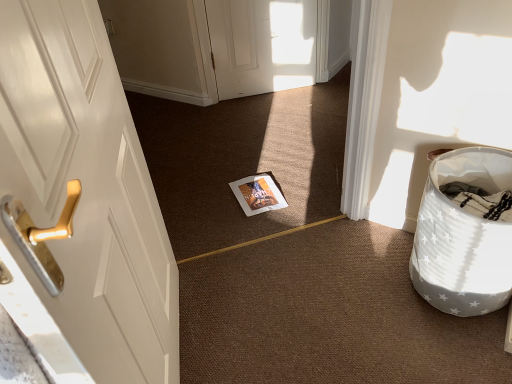
What do you see at coordinates (463, 237) in the screenshot?
I see `white star-patterned laundry basket at right` at bounding box center [463, 237].

I want to click on white star-patterned laundry basket at right, so coord(463,237).

You are a GUI agent. You are given a task and a screenshot of the screen. Output one action in this format:
    pyautogui.click(x=<x>, y=<y>)
    Task: Click on the matte paper magazine at center
    Image resolution: width=512 pixels, height=384 pixels.
    Given the screenshot: What is the action you would take?
    pyautogui.click(x=258, y=194)

What do you see at coordinates (258, 194) in the screenshot? The height and width of the screenshot is (384, 512). I see `matte paper magazine at center` at bounding box center [258, 194].

I want to click on white star-patterned laundry basket at right, so click(463, 237).

Is white star-patterned laundry basket at right at the left side of matte paper magazine at center?

In fact, white star-patterned laundry basket at right is to the right of matte paper magazine at center.

Based on the photo, is white star-patterned laundry basket at right closer to the viewer compared to matte paper magazine at center?

Yes, it is in front of matte paper magazine at center.

Which is more distant, (472, 180) or (260, 173)?

The point (260, 173) is behind.

In the scene shown: From the image's perspective, which is above, white star-patterned laundry basket at right or matte paper magazine at center?

matte paper magazine at center is shown above in the image.

From a real-world perspective, is white star-patterned laundry basket at right above or below matte paper magazine at center?

Clearly, from a real-world perspective, white star-patterned laundry basket at right is above matte paper magazine at center.

Does white star-patterned laundry basket at right have a lesser width compared to matte paper magazine at center?

No.

Can you confirm if white star-patterned laundry basket at right is taller than matte paper magazine at center?

Indeed, white star-patterned laundry basket at right has a greater height compared to matte paper magazine at center.

Looking at this image, is white star-patterned laundry basket at right bigger or smaller than matte paper magazine at center?

In the image, white star-patterned laundry basket at right appears to be larger than matte paper magazine at center.

Is matte paper magazine at center surrounded by white star-patterned laundry basket at right?

No, matte paper magazine at center is not a part of white star-patterned laundry basket at right.

Is the surface of white star-patterned laundry basket at right in direct contact with matte paper magazine at center?

No, white star-patterned laundry basket at right is not beside matte paper magazine at center.

Is white star-patterned laundry basket at right positioned with its back to matte paper magazine at center?

No, white star-patterned laundry basket at right is not facing away from matte paper magazine at center.

How many degrees apart are the facing directions of white star-patterned laundry basket at right and matte paper magazine at center?

There is a 133-degree angle between the facing directions of white star-patterned laundry basket at right and matte paper magazine at center.

Measure the distance from white star-patterned laundry basket at right to matte paper magazine at center.

white star-patterned laundry basket at right is 32.68 inches away from matte paper magazine at center.

Identify the location of magazine located behind the white star-patterned laundry basket at right. (258, 194).

Considering the positions of objects matte paper magazine at center and white star-patterned laundry basket at right in the image provided, who is more to the left, matte paper magazine at center or white star-patterned laundry basket at right?

matte paper magazine at center.

Which is in front, matte paper magazine at center or white star-patterned laundry basket at right?

white star-patterned laundry basket at right is more forward.

Which is closer to the camera, (277, 202) or (431, 247)?

Point (277, 202) is farther from the camera than point (431, 247).

From the image's perspective, is matte paper magazine at center under white star-patterned laundry basket at right?

No, from the image's perspective, matte paper magazine at center is not beneath white star-patterned laundry basket at right.

From a real-world perspective, is matte paper magazine at center located beneath white star-patterned laundry basket at right?

Yes.

Is matte paper magazine at center thinner than white star-patterned laundry basket at right?

Indeed, matte paper magazine at center has a lesser width compared to white star-patterned laundry basket at right.

Does matte paper magazine at center have a lesser height compared to white star-patterned laundry basket at right?

Correct, matte paper magazine at center is not as tall as white star-patterned laundry basket at right.

Is matte paper magazine at center bigger than white star-patterned laundry basket at right?

Incorrect, matte paper magazine at center is not larger than white star-patterned laundry basket at right.

Would you say matte paper magazine at center is outside white star-patterned laundry basket at right?

Yes, matte paper magazine at center is located beyond the bounds of white star-patterned laundry basket at right.

Is matte paper magazine at center next to white star-patterned laundry basket at right?

No, matte paper magazine at center is not in contact with white star-patterned laundry basket at right.

Does matte paper magazine at center turn towards white star-patterned laundry basket at right?

No, matte paper magazine at center is not turned towards white star-patterned laundry basket at right.

The width and height of the screenshot is (512, 384). I want to click on magazine below the white star-patterned laundry basket at right (from a real-world perspective), so click(x=258, y=194).

In the image, there is a white star-patterned laundry basket at right. Where is `magazine above it (from the image's perspective)`? The image size is (512, 384). magazine above it (from the image's perspective) is located at coordinates (258, 194).

Identify the location of magazine that appears behind the white star-patterned laundry basket at right. (258, 194).